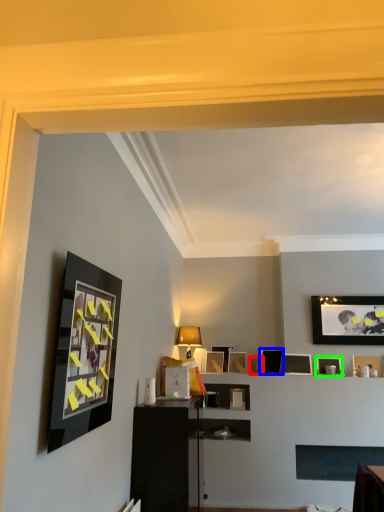
Question: Which object is the farthest from picture frame (highlighted by a red box)? Choose among these: picture frame (highlighted by a blue box) or picture frame (highlighted by a green box).

Choices:
 (A) picture frame
 (B) picture frame

Answer: (B)